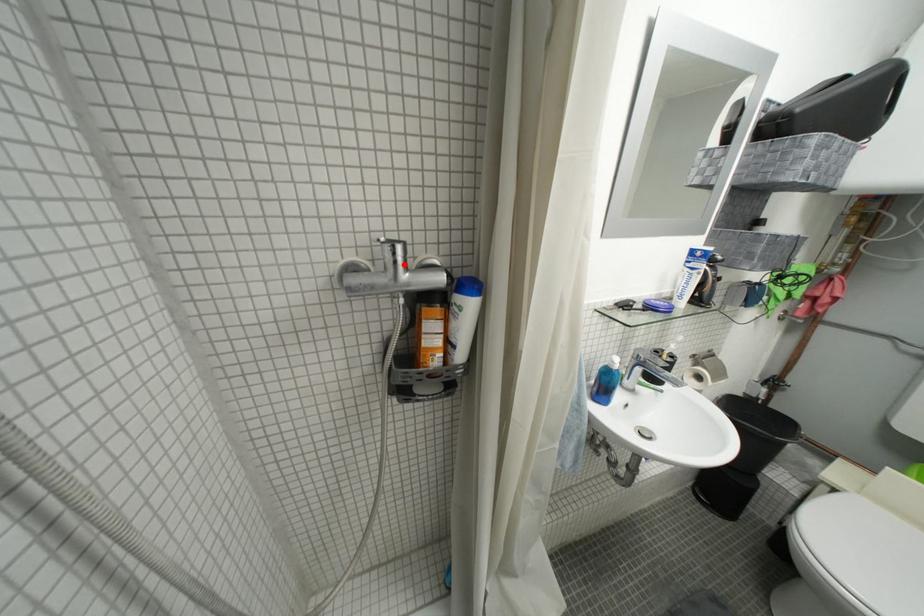
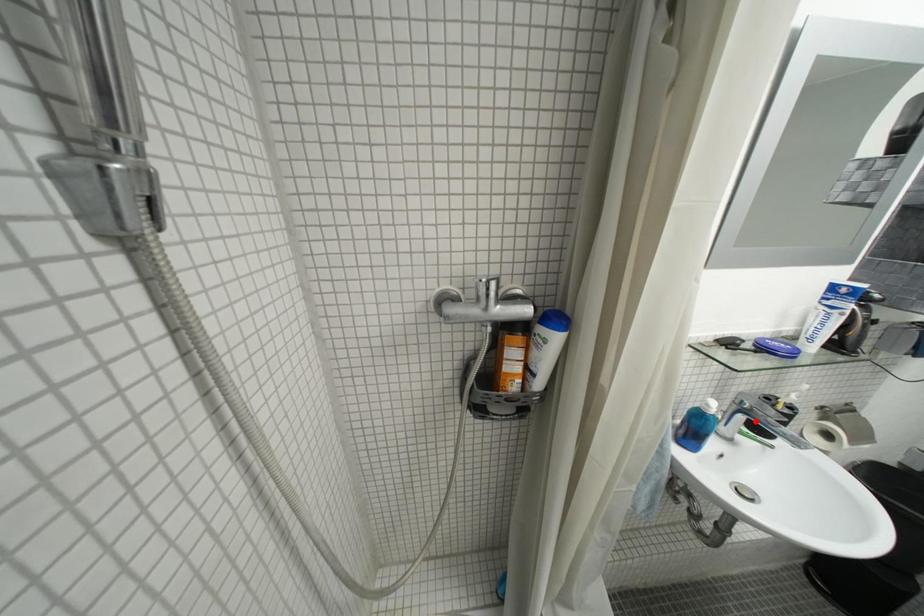
I am providing you with two images of the same scene from different viewpoints. A red point is marked on the first image and another point is marked on the second image. Does the point marked in image1 correspond to the same location as the one in image2?

No